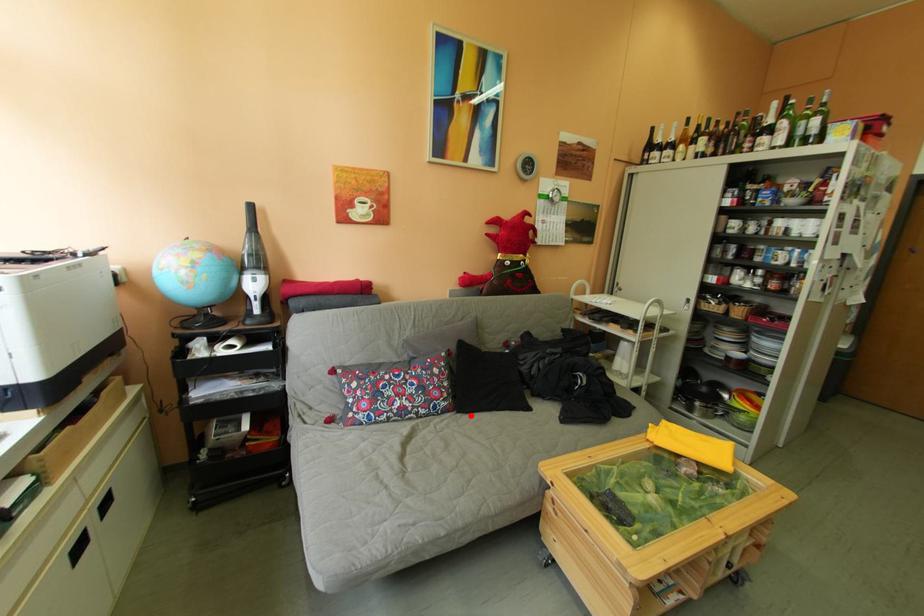
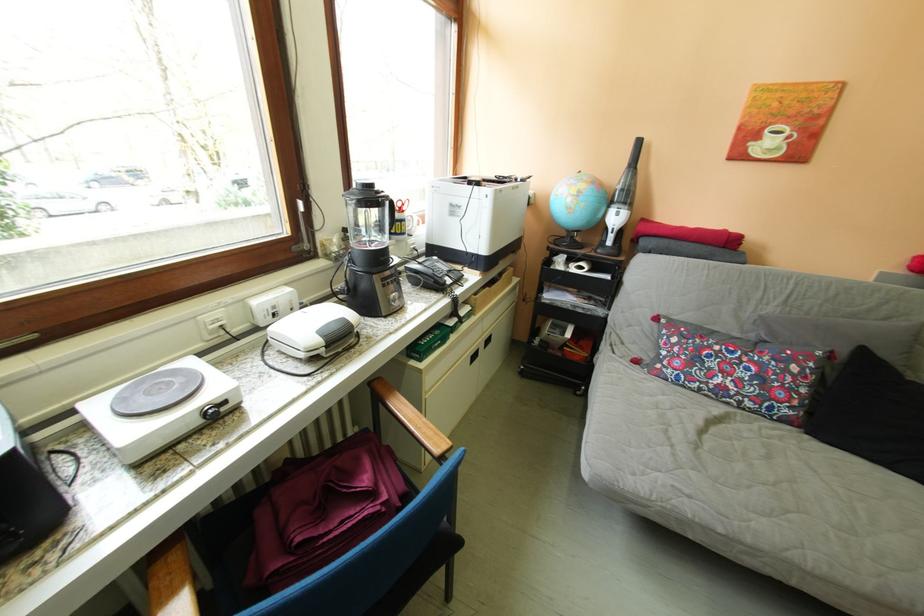
Question: I am providing you with two images of the same scene from different viewpoints. Image1 has a red point marked. In image2, the corresponding 3D location appears at what relative position? Reply with the corresponding letter.

Choices:
 (A) Closer
 (B) Farther

Answer: (A)